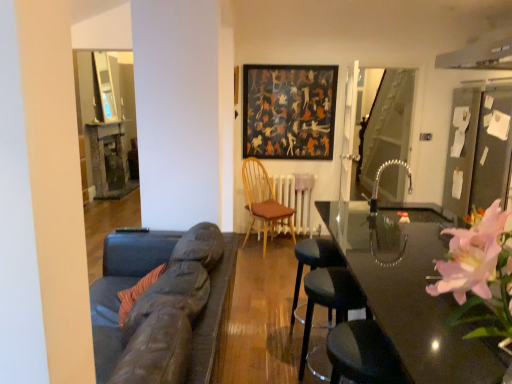
Where is `wooden chair with brown cushion at center, arranged as the first chair when viewed from the back`? wooden chair with brown cushion at center, arranged as the first chair when viewed from the back is located at coordinates (263, 201).

What do you see at coordinates (289, 111) in the screenshot? This screenshot has width=512, height=384. I see `dark textured painting at upper center` at bounding box center [289, 111].

I want to click on glossy black table at center, so click(x=410, y=295).

What is the approximate width of black leather stool at lower right, which is counted as the second chair, starting from the back?

black leather stool at lower right, which is counted as the second chair, starting from the back, is 15.89 inches in width.

Measure the distance between point (x=292, y=315) and camera.

Point (x=292, y=315) and camera are 2.82 meters apart.

Where is `black leather swivel chair at lower right`? The height and width of the screenshot is (384, 512). black leather swivel chair at lower right is located at coordinates pos(362,354).

From the picture: Which point is more distant from viewer, (x=408, y=242) or (x=361, y=182)?

The point (x=361, y=182) is farther from the camera.

Would you consider glossy black table at center to be distant from transparent glass door at right?

glossy black table at center is positioned a significant distance from transparent glass door at right.

Looking at this image, is glossy black table at center located outside transparent glass door at right?

Yes, glossy black table at center is not within transparent glass door at right.

Is black leather stool at lower right, which is counted as the second chair, starting from the back, inside or outside of glossy black table at center?

black leather stool at lower right, which is counted as the second chair, starting from the back, is spatially positioned inside glossy black table at center.

Is point (333, 302) closer or farther from the camera than point (393, 287)?

Point (333, 302) appears to be farther away from the viewer than point (393, 287).

In terms of width, does black leather stool at lower right, which is counted as the second chair, starting from the back, look wider or thinner when compared to glossy black table at center?

Considering their sizes, black leather stool at lower right, which is counted as the second chair, starting from the back, looks slimmer than glossy black table at center.

From a real-world perspective, who is located higher, black leather stool at lower right, which is counted as the second chair, starting from the back, or glossy black table at center?

In real-world perspective, glossy black table at center is above.

Does wooden chair with brown cushion at center, arranged as the first chair when viewed from the back, have a larger size compared to black leather stool at lower right, arranged as the 1th chair when viewed from the front?

Yes, wooden chair with brown cushion at center, arranged as the first chair when viewed from the back, is bigger than black leather stool at lower right, arranged as the 1th chair when viewed from the front.

In the scene shown: Could black leather stool at lower right, which is counted as the second chair, starting from the back, be considered to be inside wooden chair with brown cushion at center, arranged as the first chair when viewed from the back?

No.

What's the angular difference between wooden chair with brown cushion at center, which ranks as the second chair in front-to-back order, and black leather stool at lower right, which is counted as the second chair, starting from the back,'s facing directions?

The angular difference between wooden chair with brown cushion at center, which ranks as the second chair in front-to-back order, and black leather stool at lower right, which is counted as the second chair, starting from the back, is 51.5 degrees.

Measure the distance between wooden chair with brown cushion at center, arranged as the first chair when viewed from the back, and black leather stool at lower right, which is counted as the second chair, starting from the back.

They are 8.27 feet apart.

Between dark gray fabric bar stool at center and transparent glass door at right, which one has larger width?

dark gray fabric bar stool at center.

This screenshot has width=512, height=384. I want to click on bar stool to the left of transparent glass door at right, so pyautogui.click(x=313, y=260).

Is dark gray fabric bar stool at center spatially inside transparent glass door at right, or outside of it?

dark gray fabric bar stool at center is outside transparent glass door at right.

Which object is closer to the camera taking this photo, dark gray fabric bar stool at center or transparent glass door at right?

dark gray fabric bar stool at center is closer to the camera.

From the image's perspective, which is above, black leather swivel chair at lower right or dark gray fabric bar stool at center?

dark gray fabric bar stool at center.

Considering the sizes of objects black leather swivel chair at lower right and dark gray fabric bar stool at center in the image provided, who is bigger, black leather swivel chair at lower right or dark gray fabric bar stool at center?

dark gray fabric bar stool at center.

Is dark gray fabric bar stool at center located within black leather swivel chair at lower right?

No, dark gray fabric bar stool at center is located outside of black leather swivel chair at lower right.

Is dark gray fabric bar stool at center at the back of black leather swivel chair at lower right?

black leather swivel chair at lower right does not have its back to dark gray fabric bar stool at center.

Does black leather stool at lower right, which is counted as the second chair, starting from the back, have a lesser height compared to transparent glass door at right?

Indeed, black leather stool at lower right, which is counted as the second chair, starting from the back, has a lesser height compared to transparent glass door at right.

Image resolution: width=512 pixels, height=384 pixels. What are the coordinates of `the 2nd chair in front when counting from the transparent glass door at right` in the screenshot? It's located at (329, 299).

Are black leather stool at lower right, which is counted as the second chair, starting from the back, and transparent glass door at right beside each other?

There is a gap between black leather stool at lower right, which is counted as the second chair, starting from the back, and transparent glass door at right.

Who is smaller, black leather stool at lower right, arranged as the 1th chair when viewed from the front, or transparent glass door at right?

With smaller size is black leather stool at lower right, arranged as the 1th chair when viewed from the front.

Who is shorter, transparent glass door at right or dark textured painting at upper center?

With less height is dark textured painting at upper center.

From the image's perspective, relative to dark textured painting at upper center, is transparent glass door at right above or below?

From the image's perspective, transparent glass door at right appears below dark textured painting at upper center.

Is the position of transparent glass door at right more distant than that of dark textured painting at upper center?

No, it is in front of dark textured painting at upper center.

Are transparent glass door at right and dark textured painting at upper center located far from each other?

Actually, transparent glass door at right and dark textured painting at upper center are a little close together.

In the image, there is a transparent glass door at right. Where is `table below it (from the image's perspective)`? The width and height of the screenshot is (512, 384). table below it (from the image's perspective) is located at coordinates (410, 295).

This screenshot has height=384, width=512. In order to click on the 1st chair counting from the left of the glossy black table at center in this screenshot , I will do `click(329, 299)`.

Based on their spatial positions, is black leather swivel chair at lower right or dark textured painting at upper center closer to transparent glass door at right?

dark textured painting at upper center lies closer to transparent glass door at right than the other object.

From the image, which object appears to be farther from dark textured painting at upper center, wooden chair with brown cushion at center, arranged as the first chair when viewed from the back, or black leather stool at lower right, arranged as the 1th chair when viewed from the front?

black leather stool at lower right, arranged as the 1th chair when viewed from the front.

Looking at the image, which one is located closer to dark textured painting at upper center, dark gray fabric bar stool at center or wooden chair with brown cushion at center, which ranks as the second chair in front-to-back order?

wooden chair with brown cushion at center, which ranks as the second chair in front-to-back order, is positioned closer to the anchor dark textured painting at upper center.

Considering their positions, is glossy black table at center positioned closer to dark textured painting at upper center than wooden chair with brown cushion at center, which ranks as the second chair in front-to-back order?

wooden chair with brown cushion at center, which ranks as the second chair in front-to-back order.

Estimate the real-world distances between objects in this image. Which object is further from glossy black table at center, dark gray fabric bar stool at center or black leather stool at lower right, which is counted as the second chair, starting from the back?

dark gray fabric bar stool at center is positioned further to the anchor glossy black table at center.

From the image, which object appears to be nearer to black leather swivel chair at lower right, wooden chair with brown cushion at center, which ranks as the second chair in front-to-back order, or black leather stool at lower right, which is counted as the second chair, starting from the back?

The object closer to black leather swivel chair at lower right is black leather stool at lower right, which is counted as the second chair, starting from the back.

Estimate the real-world distances between objects in this image. Which object is further from dark textured painting at upper center, dark gray fabric bar stool at center or glossy black table at center?

The object further to dark textured painting at upper center is dark gray fabric bar stool at center.

Estimate the real-world distances between objects in this image. Which object is further from glossy black table at center, dark gray fabric bar stool at center or transparent glass door at right?

Based on the image, transparent glass door at right appears to be further to glossy black table at center.

Locate an element on the screen. bar stool between glossy black table at center and wooden chair with brown cushion at center, arranged as the first chair when viewed from the back, along the z-axis is located at coordinates (313, 260).

This screenshot has width=512, height=384. I want to click on chair located between black leather stool at lower right, arranged as the 1th chair when viewed from the front, and dark textured painting at upper center in the depth direction, so click(x=263, y=201).

You are a GUI agent. You are given a task and a screenshot of the screen. Output one action in this format:
    pyautogui.click(x=<x>, y=<y>)
    Task: Click on the glass door located between dark gray fabric bar stool at center and dark textured painting at upper center in the depth direction
    
    Given the screenshot: What is the action you would take?
    pyautogui.click(x=386, y=125)

Where is `picture frame located between wooden chair with brown cushion at center, arranged as the first chair when viewed from the back, and transparent glass door at right in the left-right direction`? picture frame located between wooden chair with brown cushion at center, arranged as the first chair when viewed from the back, and transparent glass door at right in the left-right direction is located at coordinates (289, 111).